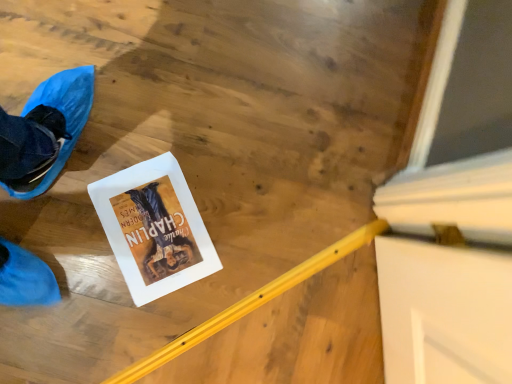
Where is `vacant region to the left of white paper book cover at center`? The width and height of the screenshot is (512, 384). vacant region to the left of white paper book cover at center is located at coordinates (83, 172).